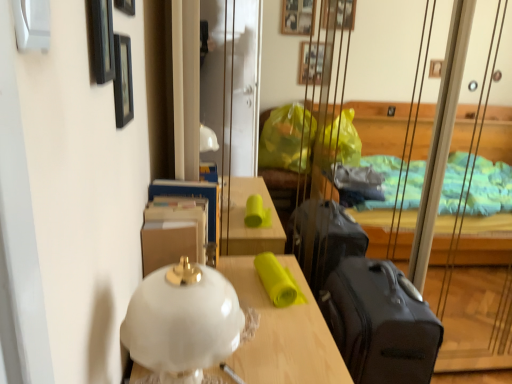
Describe the element at coordinates (380, 323) in the screenshot. This screenshot has width=512, height=384. I see `black smooth suitcase at right` at that location.

What do you see at coordinates (282, 332) in the screenshot? This screenshot has height=384, width=512. I see `white matte lampshade at center` at bounding box center [282, 332].

Measure the distance between point (101, 77) and camera.

A distance of 26.85 inches exists between point (101, 77) and camera.

You are a GUI agent. You are given a task and a screenshot of the screen. Output one action in this format:
    pyautogui.click(x=<x>, y=<y>)
    Task: Click on the black matte picture frame at upper left, which appears as the first picture frame when viewed from the front
    This screenshot has height=384, width=512.
    Given the screenshot: What is the action you would take?
    pyautogui.click(x=100, y=40)

Where is `black smooth suitcase at right`? black smooth suitcase at right is located at coordinates point(380,323).

Locate an element on the screen. Image resolution: width=512 pixels, height=384 pixels. the 2nd picture frame counting from the right of the black matte picture frame at upper left, positioned as the third picture frame in front-to-back order is located at coordinates (100, 40).

From the image's perspective, which one is positioned lower, black matte picture frame at upper left, positioned as the 3th picture frame in back-to-front order, or black matte picture frame at upper left, positioned as the third picture frame in front-to-back order?

black matte picture frame at upper left, positioned as the third picture frame in front-to-back order.

Which of these two, black matte picture frame at upper left, which appears as the first picture frame when viewed from the front, or black matte picture frame at upper left, positioned as the third picture frame in front-to-back order, is wider?

With larger width is black matte picture frame at upper left, positioned as the third picture frame in front-to-back order.

Is white matte lampshade at center aimed at black matte picture frame at upper left, which appears as the first picture frame when viewed from the front?

No, white matte lampshade at center is not facing towards black matte picture frame at upper left, which appears as the first picture frame when viewed from the front.

Is white matte lampshade at center inside or outside of black matte picture frame at upper left, which appears as the first picture frame when viewed from the front?

white matte lampshade at center exists outside the volume of black matte picture frame at upper left, which appears as the first picture frame when viewed from the front.

Considering the relative sizes of white matte lampshade at center and black matte picture frame at upper left, which appears as the first picture frame when viewed from the front, in the image provided, is white matte lampshade at center shorter than black matte picture frame at upper left, which appears as the first picture frame when viewed from the front,?

No.

Does point (293, 348) lie in front of point (102, 60)?

No, (293, 348) is further to viewer.

From the picture: Which is farther from the camera, (357, 316) or (169, 343)?

The point (357, 316) is farther from the camera.

Is black smooth suitcase at right to the left of white glass lamp at center from the viewer's perspective?

No, black smooth suitcase at right is not to the left of white glass lamp at center.

Identify the location of lamp located in front of the black smooth suitcase at right. The height and width of the screenshot is (384, 512). (182, 321).

Considering the sizes of black smooth suitcase at right and white glass lamp at center in the image, is black smooth suitcase at right taller or shorter than white glass lamp at center?

black smooth suitcase at right is taller than white glass lamp at center.

From their relative heights in the image, would you say white matte lampshade at center is taller or shorter than black matte picture frame at upper left, which is counted as the first picture frame, starting from the back?

Clearly, white matte lampshade at center is taller compared to black matte picture frame at upper left, which is counted as the first picture frame, starting from the back.

Considering the positions of objects white matte lampshade at center and black matte picture frame at upper left, which is counted as the first picture frame, starting from the back, in the image provided, who is more to the right, white matte lampshade at center or black matte picture frame at upper left, which is counted as the first picture frame, starting from the back,?

white matte lampshade at center is more to the right.

Considering the relative sizes of white matte lampshade at center and black matte picture frame at upper left, which is counted as the first picture frame, starting from the back, in the image provided, is white matte lampshade at center smaller than black matte picture frame at upper left, which is counted as the first picture frame, starting from the back,?

No, white matte lampshade at center is not smaller than black matte picture frame at upper left, which is counted as the first picture frame, starting from the back.

How distant is white glass lamp at center from wooden picture frame at upper left, which is the 2th picture frame from front to back?

A distance of 24.07 inches exists between white glass lamp at center and wooden picture frame at upper left, which is the 2th picture frame from front to back.

Which point is more forward, (225, 292) or (128, 0)?

The point (225, 292) is in front.

Does white glass lamp at center come behind wooden picture frame at upper left, which is counted as the second picture frame, starting from the back?

No, white glass lamp at center is closer to the viewer.

How different are the orientations of white glass lamp at center and wooden picture frame at upper left, which is counted as the second picture frame, starting from the back, in degrees?

The facing directions of white glass lamp at center and wooden picture frame at upper left, which is counted as the second picture frame, starting from the back, are 3.21 degrees apart.

Does point (108, 40) appear closer or farther from the camera than point (410, 347)?

Point (108, 40) is closer to the camera than point (410, 347).

Is black matte picture frame at upper left, positioned as the 3th picture frame in back-to-front order, not within black smooth suitcase at right?

Yes, black matte picture frame at upper left, positioned as the 3th picture frame in back-to-front order, is not within black smooth suitcase at right.

Between black matte picture frame at upper left, positioned as the 3th picture frame in back-to-front order, and black smooth suitcase at right, which one has less height?

Standing shorter between the two is black matte picture frame at upper left, positioned as the 3th picture frame in back-to-front order.

How different are the orientations of wooden picture frame at upper left, which is the 2th picture frame from front to back, and white glass lamp at center in degrees?

3.21 degrees separate the facing orientations of wooden picture frame at upper left, which is the 2th picture frame from front to back, and white glass lamp at center.

Is wooden picture frame at upper left, which is the 2th picture frame from front to back, positioned before white glass lamp at center?

No, wooden picture frame at upper left, which is the 2th picture frame from front to back, is further to the viewer.

From the image's perspective, is wooden picture frame at upper left, which is the 2th picture frame from front to back, above white glass lamp at center?

Yes, from the image's perspective, wooden picture frame at upper left, which is the 2th picture frame from front to back, is on top of white glass lamp at center.

Which is in front, point (116, 7) or point (170, 320)?

The point (170, 320) is in front.

Identify the location of picture frame that is the 1st object located above the black matte picture frame at upper left, which is counted as the first picture frame, starting from the back (from the image's perspective). Image resolution: width=512 pixels, height=384 pixels. click(x=100, y=40).

Where is `table that is under the black matte picture frame at upper left, which appears as the first picture frame when viewed from the front (from a real-world perspective)`? table that is under the black matte picture frame at upper left, which appears as the first picture frame when viewed from the front (from a real-world perspective) is located at coordinates (282, 332).

Estimate the real-world distances between objects in this image. Which object is closer to black matte picture frame at upper left, positioned as the third picture frame in front-to-back order, wooden picture frame at upper left, which is counted as the second picture frame, starting from the back, or white matte lampshade at center?

wooden picture frame at upper left, which is counted as the second picture frame, starting from the back, is closer to black matte picture frame at upper left, positioned as the third picture frame in front-to-back order.

Based on their spatial positions, is wooden picture frame at upper left, which is counted as the second picture frame, starting from the back, or white glass lamp at center closer to white matte lampshade at center?

white glass lamp at center lies closer to white matte lampshade at center than the other object.

Consider the image. Considering their positions, is black matte picture frame at upper left, which appears as the first picture frame when viewed from the front, positioned closer to black smooth suitcase at right than wooden picture frame at upper left, which is the 2th picture frame from front to back?

Based on the image, black matte picture frame at upper left, which appears as the first picture frame when viewed from the front, appears to be nearer to black smooth suitcase at right.

Considering their positions, is black smooth suitcase at right positioned further to black matte picture frame at upper left, positioned as the third picture frame in front-to-back order, than white glass lamp at center?

Based on the image, black smooth suitcase at right appears to be further to black matte picture frame at upper left, positioned as the third picture frame in front-to-back order.

Looking at the image, which one is located closer to black matte picture frame at upper left, positioned as the third picture frame in front-to-back order, white matte lampshade at center or white glass lamp at center?

white glass lamp at center lies closer to black matte picture frame at upper left, positioned as the third picture frame in front-to-back order, than the other object.

From the image, which object appears to be nearer to wooden picture frame at upper left, which is counted as the second picture frame, starting from the back, white matte lampshade at center or black smooth suitcase at right?

white matte lampshade at center.

Based on their spatial positions, is black matte picture frame at upper left, positioned as the third picture frame in front-to-back order, or black matte picture frame at upper left, which appears as the first picture frame when viewed from the front, further from white glass lamp at center?

The object further to white glass lamp at center is black matte picture frame at upper left, positioned as the third picture frame in front-to-back order.

Looking at the image, which one is located further to wooden picture frame at upper left, which is counted as the second picture frame, starting from the back, black matte picture frame at upper left, positioned as the 3th picture frame in back-to-front order, or black matte picture frame at upper left, positioned as the third picture frame in front-to-back order?

black matte picture frame at upper left, positioned as the 3th picture frame in back-to-front order, is positioned further to the anchor wooden picture frame at upper left, which is counted as the second picture frame, starting from the back.

At what (x,y) coordinates should I click in order to perform the action: click on lamp between wooden picture frame at upper left, which is counted as the second picture frame, starting from the back, and white matte lampshade at center, in the vertical direction. Please return your answer as a coordinate pair (x, y). Looking at the image, I should click on (182, 321).

At what (x,y) coordinates should I click in order to perform the action: click on lamp between black matte picture frame at upper left, positioned as the third picture frame in front-to-back order, and white matte lampshade at center in the up-down direction. Please return your answer as a coordinate pair (x, y). Looking at the image, I should click on click(x=182, y=321).

Identify the location of suitcase between black matte picture frame at upper left, positioned as the 3th picture frame in back-to-front order, and white matte lampshade at center, in the vertical direction. pos(380,323).

At what (x,y) coordinates should I click in order to perform the action: click on picture frame between black matte picture frame at upper left, which appears as the first picture frame when viewed from the front, and white glass lamp at center vertically. Please return your answer as a coordinate pair (x, y). The height and width of the screenshot is (384, 512). Looking at the image, I should click on click(x=123, y=81).